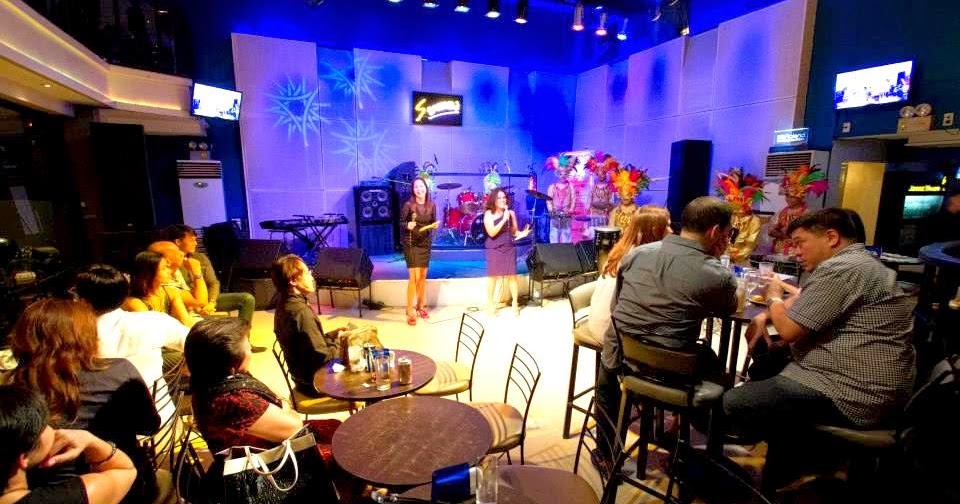
The height and width of the screenshot is (504, 960). Find the location of `chair`. chair is located at coordinates (517, 425), (451, 373), (277, 467), (300, 397), (164, 445), (164, 486), (649, 395), (849, 435), (584, 337), (329, 271).